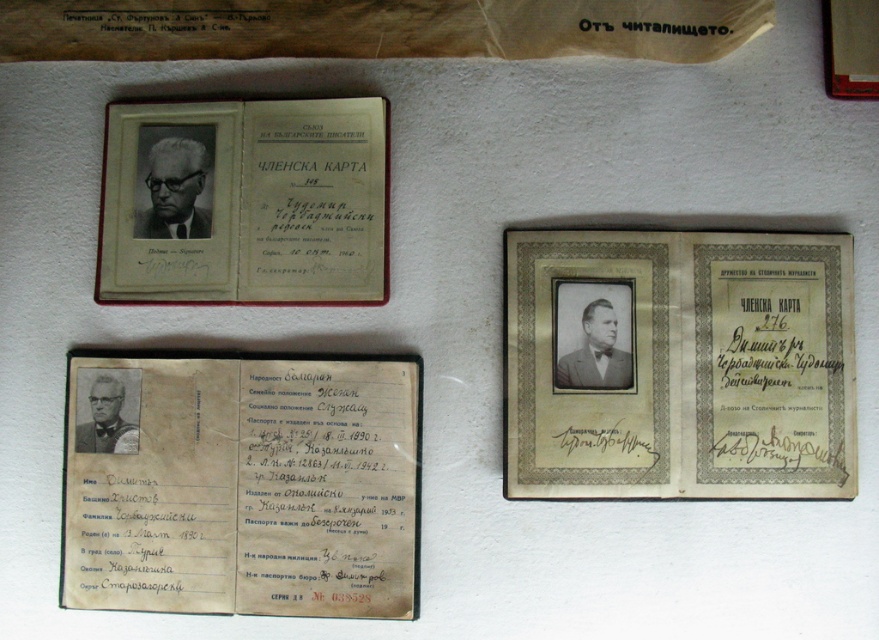
Question: Does yellowed paper passport at center have a greater width compared to matte paper membership card at upper left?

Choices:
 (A) yes
 (B) no

Answer: (A)

Question: Is gold textured paper at center bigger than matte paper membership card at upper left?

Choices:
 (A) yes
 (B) no

Answer: (A)

Question: Which point is farther to the camera?

Choices:
 (A) (505, 412)
 (B) (379, 570)
 (C) (269, 269)

Answer: (C)

Question: Which is farther from the gold textured paper at center?

Choices:
 (A) yellowed paper passport at center
 (B) matte paper membership card at upper left

Answer: (B)

Question: Does gold textured paper at center have a smaller size compared to yellowed paper passport at center?

Choices:
 (A) yes
 (B) no

Answer: (A)

Question: Which object is farther from the camera taking this photo?

Choices:
 (A) yellowed paper passport at center
 (B) matte paper membership card at upper left
 (C) gold textured paper at center

Answer: (B)